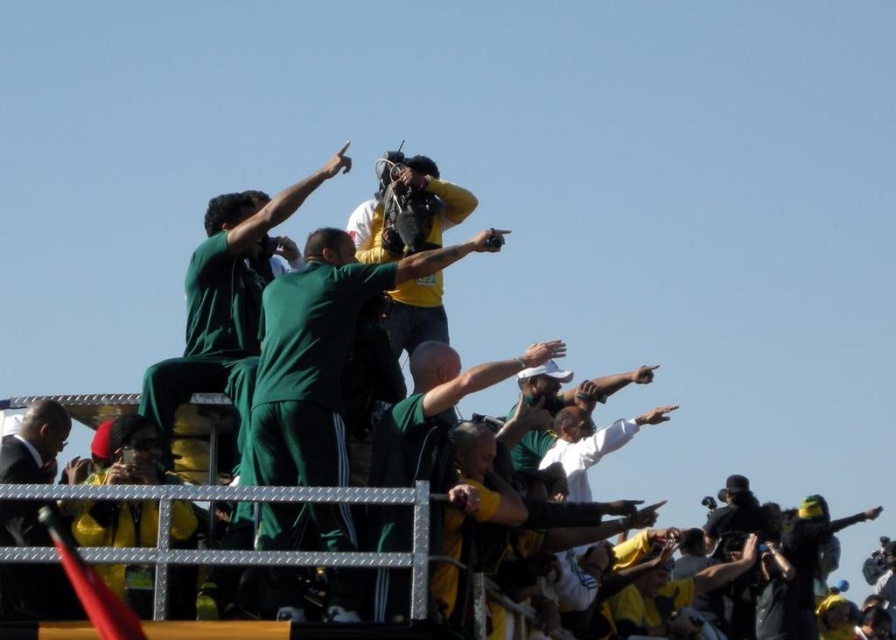
Question: Among these objects, which one is nearest to the camera?

Choices:
 (A) black suit at lower left
 (B) green jersey at center

Answer: (B)

Question: Does green matte uniform at center have a lesser width compared to black suit at lower left?

Choices:
 (A) yes
 (B) no

Answer: (B)

Question: Which is farther from the black suit at lower left?

Choices:
 (A) green jersey at center
 (B) green matte uniform at center

Answer: (A)

Question: Can you confirm if green matte uniform at center is positioned above green jersey at center?

Choices:
 (A) yes
 (B) no

Answer: (A)

Question: Among these objects, which one is farthest from the camera?

Choices:
 (A) green jersey at center
 (B) black suit at lower left

Answer: (B)

Question: Does green matte uniform at center appear on the right side of black suit at lower left?

Choices:
 (A) no
 (B) yes

Answer: (B)